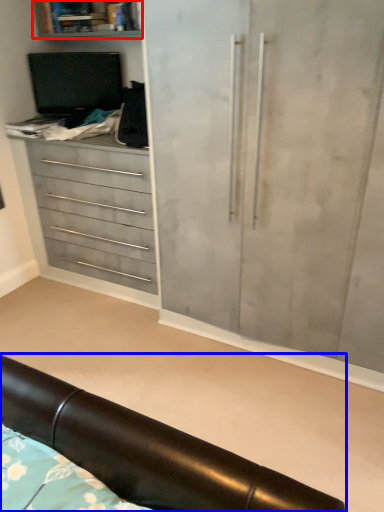
Question: Among these objects, which one is farthest to the camera, shelf (highlighted by a red box) or furniture (highlighted by a blue box)?

Choices:
 (A) shelf
 (B) furniture

Answer: (A)